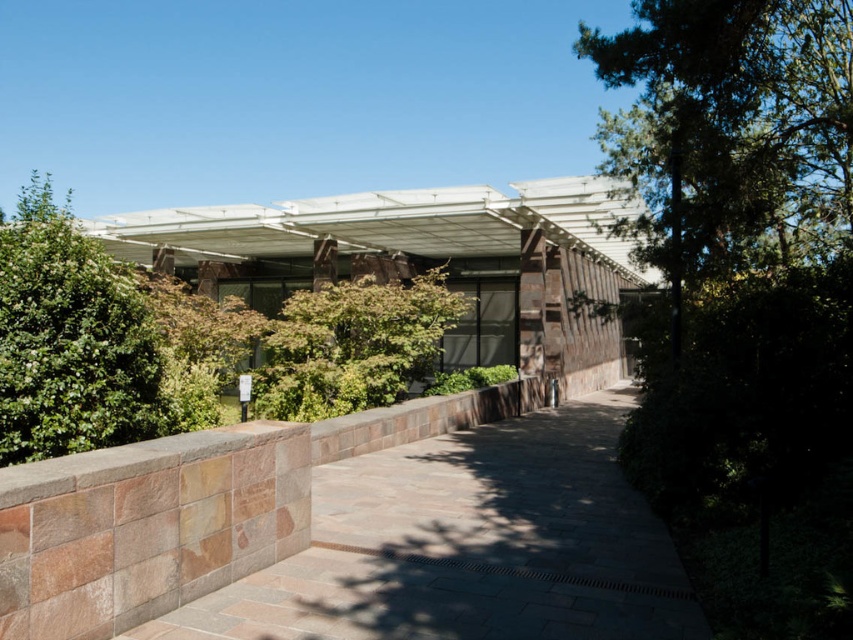
Between green leafy bush at left and green leafy tree at center, which one appears on the right side from the viewer's perspective?

Positioned to the right is green leafy tree at center.

This screenshot has width=853, height=640. What do you see at coordinates (70, 339) in the screenshot?
I see `green leafy bush at left` at bounding box center [70, 339].

In order to click on green leafy bush at left in this screenshot , I will do `click(70, 339)`.

Between point (312, 468) and point (412, 285), which one is positioned behind?

Positioned behind is point (412, 285).

Is point (621, 564) in front of point (300, 289)?

That is True.

Image resolution: width=853 pixels, height=640 pixels. I want to click on brown stone path at center, so click(469, 545).

At what (x,y) coordinates should I click in order to perform the action: click on brown stone path at center. Please return your answer as a coordinate pair (x, y). Looking at the image, I should click on (469, 545).

Does brown stone path at center appear on the left side of green leafy bush at left?

Incorrect, brown stone path at center is not on the left side of green leafy bush at left.

Locate an element on the screen. brown stone path at center is located at coordinates (469, 545).